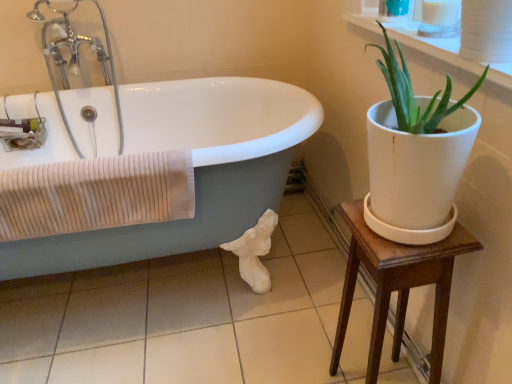
Identify the location of vacant space situated above white glossy tile at lower center (from a real-world perspective). This screenshot has width=512, height=384. (195, 306).